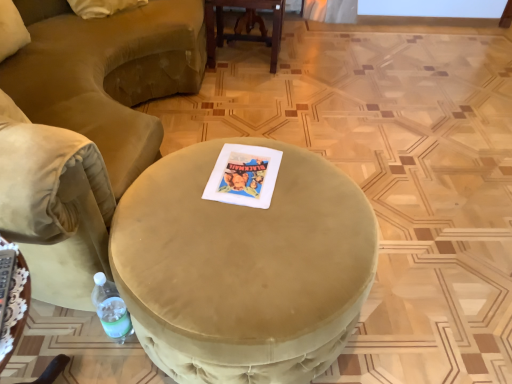
In order to face wooden table at center, the 1th table viewed from the right, should I rotate leftwards or rightwards?

To align with it, rotate left about 1.048°.

Describe the element at coordinates (86, 132) in the screenshot. The height and width of the screenshot is (384, 512). I see `velvet beige chair at lower left` at that location.

You are a GUI agent. You are given a task and a screenshot of the screen. Output one action in this format:
    pyautogui.click(x=<x>, y=<y>)
    Task: Click on the satin beige ottoman at center, the first table viewed from the front
    
    Given the screenshot: What is the action you would take?
    pyautogui.click(x=15, y=310)

What do you see at coordinates (15, 310) in the screenshot? The image size is (512, 384). I see `satin beige ottoman at center, the first table viewed from the front` at bounding box center [15, 310].

Identify the location of translucent plastic bottle at lower left. (111, 309).

Based on the photo, is translucent plastic bottle at lower left next to velvet beige chair at lower left and touching it?

translucent plastic bottle at lower left and velvet beige chair at lower left are not in contact.

Consider the image. From a real-world perspective, relative to velvet beige chair at lower left, is translucent plastic bottle at lower left vertically above or below?

→ From a real-world perspective, translucent plastic bottle at lower left is physically below velvet beige chair at lower left.

From the image's perspective, does translucent plastic bottle at lower left appear lower than velvet beige chair at lower left?

Yes, from the image's perspective, translucent plastic bottle at lower left is beneath velvet beige chair at lower left.

Which object is closer to the camera taking this photo, translucent plastic bottle at lower left or velvet beige chair at lower left?

velvet beige chair at lower left.

From the picture: How many degrees apart are the facing directions of velvet beige chair at lower left and suede-like beige ottoman at center?

The angular difference between velvet beige chair at lower left and suede-like beige ottoman at center is 94.6 degrees.

Is point (114, 44) less distant than point (135, 210)?

No, (114, 44) is further to viewer.

From a real-world perspective, which object stands above the other?

velvet beige chair at lower left, from a real-world perspective.

From the image's perspective, between velvet beige chair at lower left and suede-like beige ottoman at center, who is located below?

suede-like beige ottoman at center appears lower in the image.

From the image's perspective, relative to satin beige ottoman at center, the second table when ordered from top to bottom, is velvet beige chair at lower left above or below?

velvet beige chair at lower left is situated higher than satin beige ottoman at center, the second table when ordered from top to bottom, in the image.

Relative to satin beige ottoman at center, arranged as the first table when viewed from the left, is velvet beige chair at lower left in front or behind?

velvet beige chair at lower left is positioned closer to the viewer than satin beige ottoman at center, arranged as the first table when viewed from the left.

Who is bigger, velvet beige chair at lower left or satin beige ottoman at center, arranged as the first table when viewed from the left?

velvet beige chair at lower left.

Considering the sizes of objects velvet beige chair at lower left and satin beige ottoman at center, the second table positioned from the right, in the image provided, who is thinner, velvet beige chair at lower left or satin beige ottoman at center, the second table positioned from the right,?

Thinner between the two is satin beige ottoman at center, the second table positioned from the right.

Consider the image. Considering the sizes of objects satin beige ottoman at center, marked as the second table in a back-to-front arrangement, and wooden table at center, the second table from the left, in the image provided, who is taller, satin beige ottoman at center, marked as the second table in a back-to-front arrangement, or wooden table at center, the second table from the left,?

wooden table at center, the second table from the left.

Does point (19, 262) come behind point (212, 6)?

That is False.

Consider the image. From a real-world perspective, is satin beige ottoman at center, the second table positioned from the right, on top of wooden table at center, the 1th table viewed from the right?

Yes.

Considering the relative sizes of satin beige ottoman at center, which is the 1th table from bottom to top, and wooden table at center, the 1th table in the top-to-bottom sequence, in the image provided, is satin beige ottoman at center, which is the 1th table from bottom to top, wider than wooden table at center, the 1th table in the top-to-bottom sequence,?

No.

Would you say wooden table at center, arranged as the 2th table when viewed from the front, contains satin beige ottoman at center, the second table positioned from the right?

Definitely not — satin beige ottoman at center, the second table positioned from the right, is not inside wooden table at center, arranged as the 2th table when viewed from the front.

Is wooden table at center, the 1th table viewed from the right, bigger or smaller than satin beige ottoman at center, arranged as the first table when viewed from the left?

wooden table at center, the 1th table viewed from the right, is bigger than satin beige ottoman at center, arranged as the first table when viewed from the left.

From the image's perspective, is wooden table at center, which is the 1th table in back-to-front order, below satin beige ottoman at center, arranged as the first table when viewed from the left?

No.

At what (x,y) coordinates should I click in order to perform the action: click on table in front of the wooden table at center, the 1th table viewed from the right. Please return your answer as a coordinate pair (x, y). The width and height of the screenshot is (512, 384). Looking at the image, I should click on (15, 310).

Looking at this image, from a real-world perspective, which is physically below, satin beige ottoman at center, which is the 1th table from bottom to top, or suede-like beige ottoman at center?

From a 3D spatial view, suede-like beige ottoman at center is below.

Which point is more forward, (x=29, y=286) or (x=202, y=348)?

The point (x=29, y=286) is closer.

From the image's perspective, which is above, satin beige ottoman at center, arranged as the first table when viewed from the left, or suede-like beige ottoman at center?

suede-like beige ottoman at center appears higher in the image.

How many degrees apart are the facing directions of satin beige ottoman at center, which is the 1th table from bottom to top, and suede-like beige ottoman at center?

The facing directions of satin beige ottoman at center, which is the 1th table from bottom to top, and suede-like beige ottoman at center are 75.4 degrees apart.

Is suede-like beige ottoman at center surrounding satin beige ottoman at center, the second table when ordered from top to bottom?

No, satin beige ottoman at center, the second table when ordered from top to bottom, is not surrounded by suede-like beige ottoman at center.

Which of these two, suede-like beige ottoman at center or satin beige ottoman at center, which is the 1th table from bottom to top, is thinner?

Thinner between the two is satin beige ottoman at center, which is the 1th table from bottom to top.

Which is in front, point (262, 319) or point (19, 282)?

Point (19, 282)

The image size is (512, 384). What are the coordinates of `table in front of the suede-like beige ottoman at center` in the screenshot? It's located at (15, 310).

What are the coordinates of `bottle that appears behind the velvet beige chair at lower left` in the screenshot? It's located at (111, 309).

Find the location of a particular element. This screenshot has height=384, width=512. coffee table lying on the right of velvet beige chair at lower left is located at coordinates (243, 268).

When comparing their distances from translucent plastic bottle at lower left, does satin beige ottoman at center, the second table positioned from the right, or wooden table at center, the 1th table viewed from the right, seem further?

The object further to translucent plastic bottle at lower left is wooden table at center, the 1th table viewed from the right.

Looking at the image, which one is located further to velvet beige chair at lower left, wooden table at center, arranged as the 2th table when viewed from the front, or suede-like beige ottoman at center?

wooden table at center, arranged as the 2th table when viewed from the front, is further to velvet beige chair at lower left.

Looking at the image, which one is located further to velvet beige chair at lower left, satin beige ottoman at center, which is the 1th table from bottom to top, or translucent plastic bottle at lower left?

satin beige ottoman at center, which is the 1th table from bottom to top, lies further to velvet beige chair at lower left than the other object.

Estimate the real-world distances between objects in this image. Which object is further from satin beige ottoman at center, the second table positioned from the right, translucent plastic bottle at lower left or wooden table at center, which is the 1th table in back-to-front order?

wooden table at center, which is the 1th table in back-to-front order, lies further to satin beige ottoman at center, the second table positioned from the right, than the other object.

From the image, which object appears to be farther from velvet beige chair at lower left, satin beige ottoman at center, which is the 1th table from bottom to top, or wooden table at center, the 1th table viewed from the right?

wooden table at center, the 1th table viewed from the right, is positioned further to the anchor velvet beige chair at lower left.

Estimate the real-world distances between objects in this image. Which object is further from satin beige ottoman at center, arranged as the first table when viewed from the left, suede-like beige ottoman at center or velvet beige chair at lower left?

The object further to satin beige ottoman at center, arranged as the first table when viewed from the left, is velvet beige chair at lower left.

Which object lies further to the anchor point suede-like beige ottoman at center, velvet beige chair at lower left or translucent plastic bottle at lower left?

velvet beige chair at lower left is further to suede-like beige ottoman at center.

When comparing their distances from translucent plastic bottle at lower left, does satin beige ottoman at center, arranged as the first table when viewed from the left, or suede-like beige ottoman at center seem further?

The object further to translucent plastic bottle at lower left is suede-like beige ottoman at center.

You are a GUI agent. You are given a task and a screenshot of the screen. Output one action in this format:
    pyautogui.click(x=<x>, y=<y>)
    Task: Click on the bottle between satin beige ottoman at center, arranged as the first table when viewed from the left, and wooden table at center, which is the 1th table in back-to-front order, from front to back
    This screenshot has height=384, width=512.
    Given the screenshot: What is the action you would take?
    pyautogui.click(x=111, y=309)

I want to click on coffee table between velvet beige chair at lower left and wooden table at center, the 1th table in the top-to-bottom sequence, in the front-back direction, so click(x=243, y=268).

Image resolution: width=512 pixels, height=384 pixels. I want to click on bottle between suede-like beige ottoman at center and wooden table at center, arranged as the 2th table when viewed from the front, in the front-back direction, so click(111, 309).

Locate an element on the screen. This screenshot has height=384, width=512. bottle between velvet beige chair at lower left and wooden table at center, arranged as the 2th table when viewed from the front, in the front-back direction is located at coordinates (111, 309).